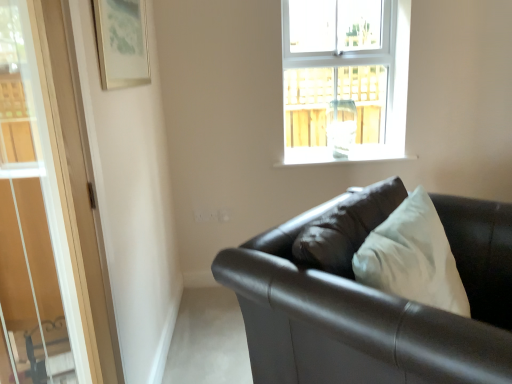
Question: Is metallic silver picture frame at upper left at the back of white smooth window sill at upper center?

Choices:
 (A) no
 (B) yes

Answer: (A)

Question: From the image's perspective, would you say white smooth window sill at upper center is shown under metallic silver picture frame at upper left?

Choices:
 (A) yes
 (B) no

Answer: (A)

Question: Is white smooth window sill at upper center surrounding metallic silver picture frame at upper left?

Choices:
 (A) no
 (B) yes

Answer: (A)

Question: Considering the relative sizes of white smooth window sill at upper center and metallic silver picture frame at upper left in the image provided, is white smooth window sill at upper center taller than metallic silver picture frame at upper left?

Choices:
 (A) yes
 (B) no

Answer: (B)

Question: Is white smooth window sill at upper center completely or partially outside of metallic silver picture frame at upper left?

Choices:
 (A) yes
 (B) no

Answer: (A)

Question: In the image, is clear glass window at upper center positioned in front of or behind metallic silver picture frame at upper left?

Choices:
 (A) front
 (B) behind

Answer: (B)

Question: Which is correct: clear glass window at upper center is inside metallic silver picture frame at upper left, or outside of it?

Choices:
 (A) inside
 (B) outside

Answer: (B)

Question: Is clear glass window at upper center wider or thinner than metallic silver picture frame at upper left?

Choices:
 (A) thin
 (B) wide

Answer: (B)

Question: Considering the positions of clear glass window at upper center and metallic silver picture frame at upper left in the image, is clear glass window at upper center taller or shorter than metallic silver picture frame at upper left?

Choices:
 (A) tall
 (B) short

Answer: (A)

Question: Considering their positions, is metallic silver picture frame at upper left located in front of or behind white smooth window sill at upper center?

Choices:
 (A) front
 (B) behind

Answer: (A)

Question: Is metallic silver picture frame at upper left wider or thinner than white smooth window sill at upper center?

Choices:
 (A) wide
 (B) thin

Answer: (B)

Question: Is point (118, 77) closer or farther from the camera than point (309, 165)?

Choices:
 (A) closer
 (B) farther

Answer: (A)

Question: Is metallic silver picture frame at upper left taller or shorter than white smooth window sill at upper center?

Choices:
 (A) tall
 (B) short

Answer: (A)

Question: Considering their positions, is clear glass window at upper center located in front of or behind white smooth window sill at upper center?

Choices:
 (A) front
 (B) behind

Answer: (A)

Question: In terms of width, does clear glass window at upper center look wider or thinner when compared to white smooth window sill at upper center?

Choices:
 (A) wide
 (B) thin

Answer: (A)